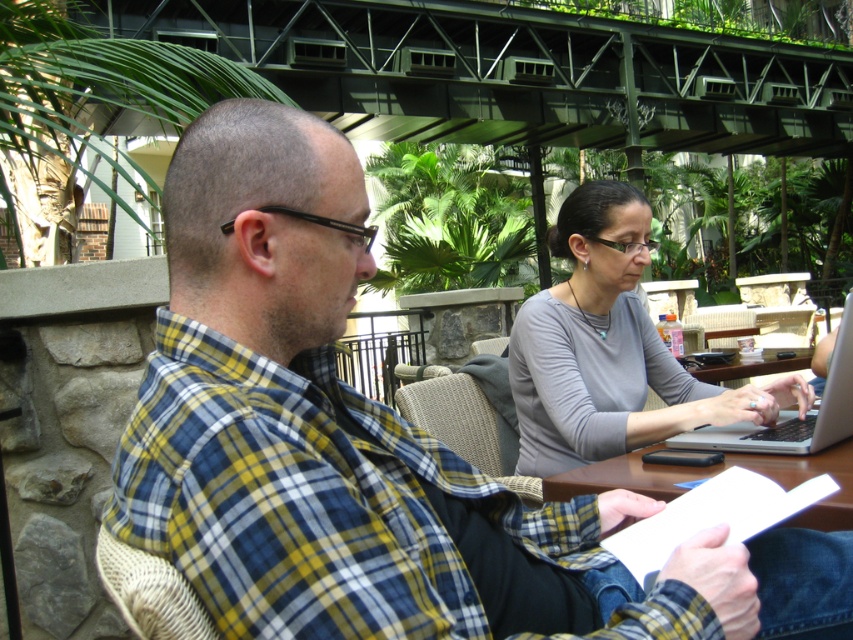
Question: Which object is farther from the camera taking this photo?

Choices:
 (A) silver metallic laptop at center
 (B) gray matte shirt at center

Answer: (B)

Question: Which point is farther from the camera taking this photo?

Choices:
 (A) (573, 426)
 (B) (302, 628)
 (C) (822, 401)

Answer: (A)

Question: Does plaid shirt at center appear on the left side of silver metallic laptop at center?

Choices:
 (A) no
 (B) yes

Answer: (B)

Question: Is plaid shirt at center wider than silver metallic laptop at center?

Choices:
 (A) yes
 (B) no

Answer: (A)

Question: Which point appears farthest from the camera in this image?

Choices:
 (A) (317, 540)
 (B) (796, 445)
 (C) (709, 432)

Answer: (C)

Question: Does plaid shirt at center appear on the left side of silver metallic laptop at center?

Choices:
 (A) yes
 (B) no

Answer: (A)